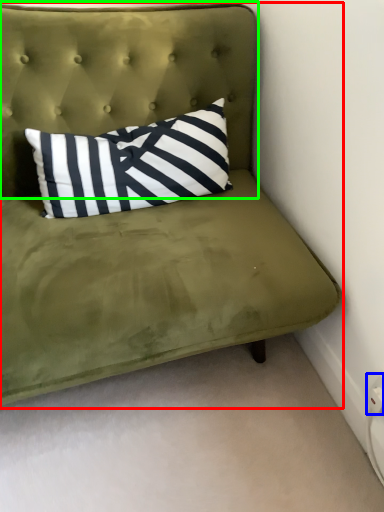
Question: Which object is positioned closest to studio couch (highlighted by a red box)? Select from electric outlet (highlighted by a blue box) and headboard (highlighted by a green box).

Choices:
 (A) electric outlet
 (B) headboard

Answer: (B)